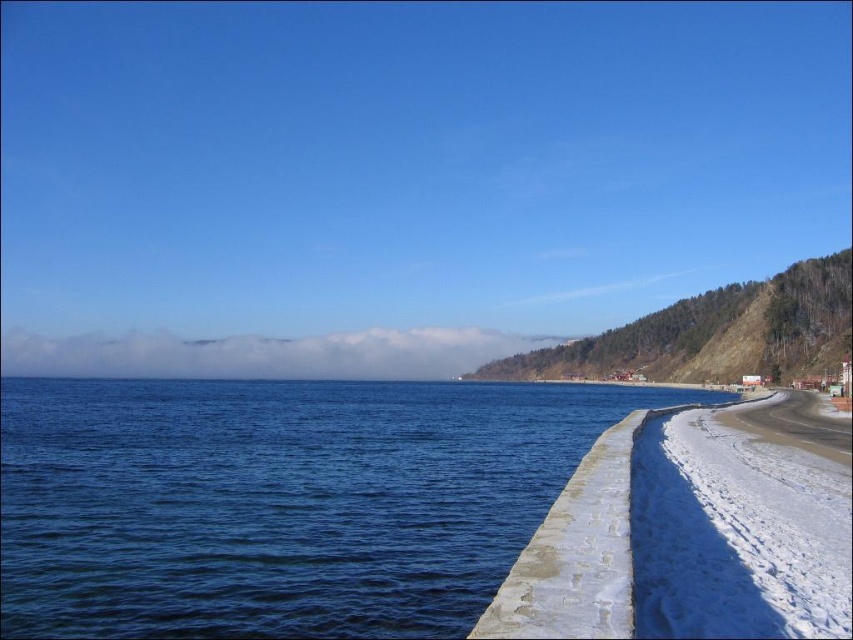
Question: Is blue water at lower left bigger than white snow at lower right?

Choices:
 (A) yes
 (B) no

Answer: (A)

Question: Which point is closer to the camera?

Choices:
 (A) (151, 528)
 (B) (650, 483)

Answer: (B)

Question: Does blue water at lower left come in front of white snow at lower right?

Choices:
 (A) yes
 (B) no

Answer: (B)

Question: Which object is farther from the camera taking this photo?

Choices:
 (A) white snow at lower right
 (B) blue water at lower left

Answer: (B)

Question: Does blue water at lower left have a greater width compared to white snow at lower right?

Choices:
 (A) no
 (B) yes

Answer: (B)